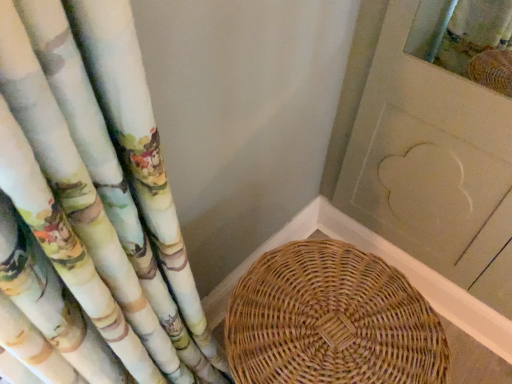
You are a GUI agent. You are given a task and a screenshot of the screen. Output one action in this format:
    pyautogui.click(x=<x>, y=<y>)
    Task: Click on the natural brown woven basket at lower right
    The image size is (512, 384).
    Given the screenshot: What is the action you would take?
    pyautogui.click(x=331, y=321)

The width and height of the screenshot is (512, 384). Describe the element at coordinates (331, 321) in the screenshot. I see `natural brown woven basket at lower right` at that location.

Find the location of `natural brown woven basket at lower right`. natural brown woven basket at lower right is located at coordinates (331, 321).